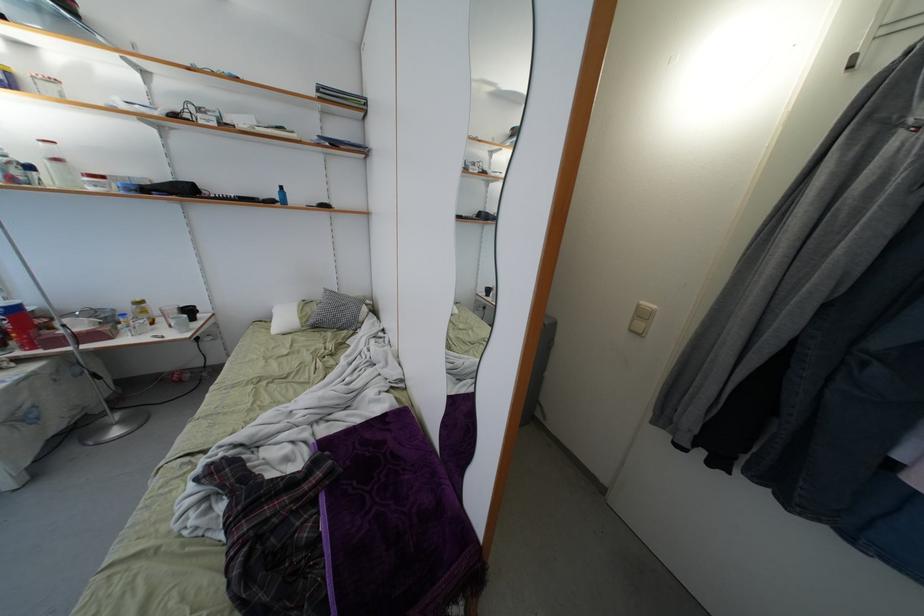
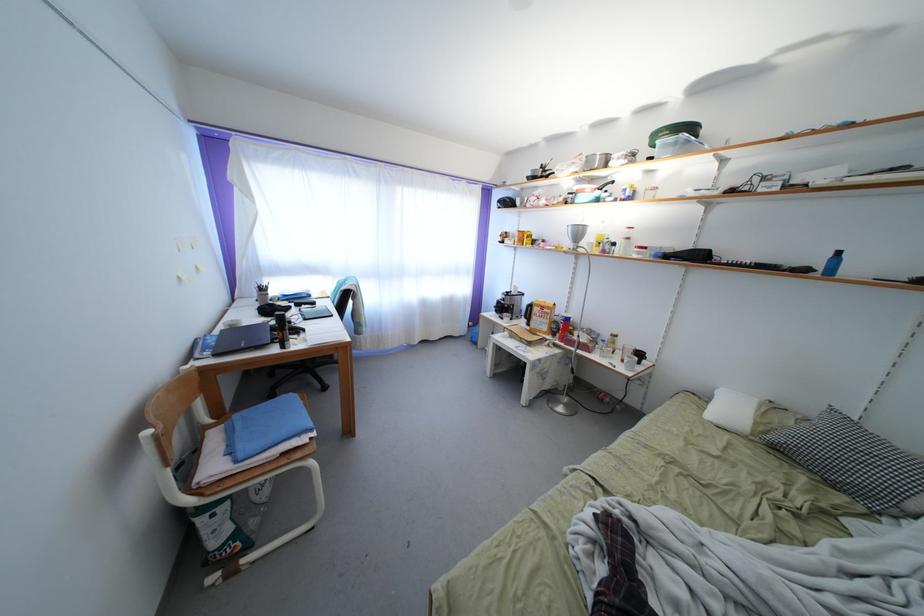
In the second image, find the point that corresponds to (x=314, y=328) in the first image.

(779, 444)